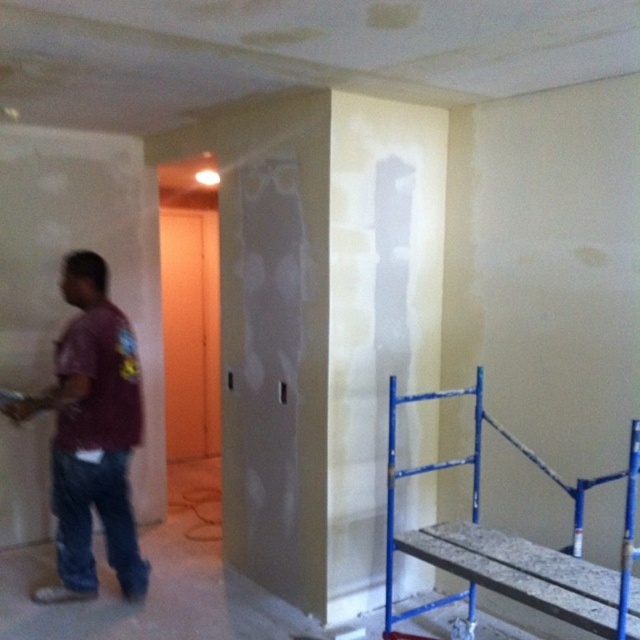
Question: Which point appears farthest from the camera in this image?

Choices:
 (A) (99, 260)
 (B) (468, 630)

Answer: (B)

Question: Is maroon fabric shirt at left further to camera compared to blue metal scaffolding at lower right?

Choices:
 (A) no
 (B) yes

Answer: (B)

Question: Among these objects, which one is nearest to the camera?

Choices:
 (A) maroon fabric shirt at left
 (B) blue metal scaffolding at lower right

Answer: (B)

Question: Is maroon fabric shirt at left above blue metal scaffolding at lower right?

Choices:
 (A) no
 (B) yes

Answer: (B)

Question: Can you confirm if maroon fabric shirt at left is positioned to the right of blue metal scaffolding at lower right?

Choices:
 (A) no
 (B) yes

Answer: (A)

Question: Which point appears closest to the camera in this image?

Choices:
 (A) (120, 436)
 (B) (506, 541)

Answer: (B)